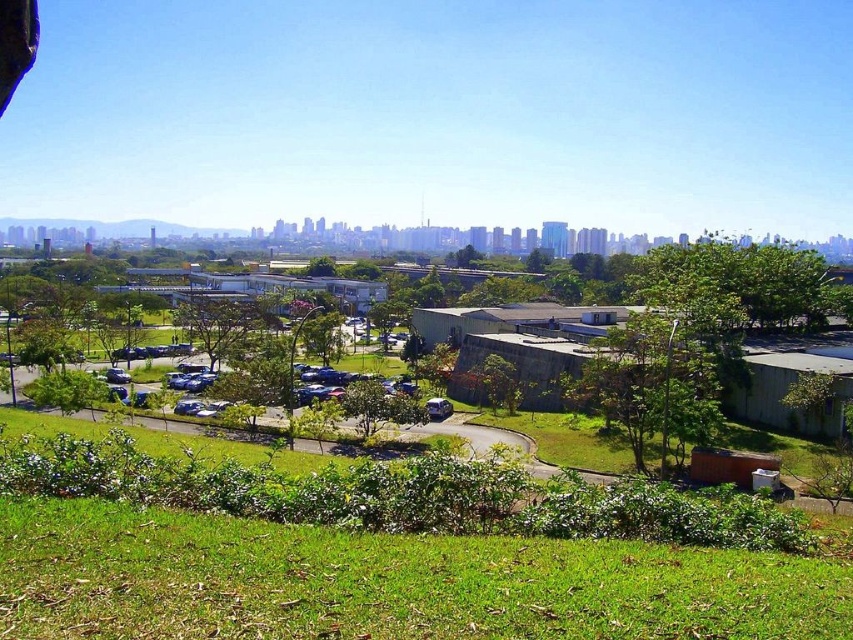
Question: Can you confirm if green grassy park at lower left is positioned to the right of green leafy tree at center?

Choices:
 (A) yes
 (B) no

Answer: (B)

Question: Can you confirm if green grassy park at lower left is positioned to the left of green leafy tree at center?

Choices:
 (A) yes
 (B) no

Answer: (A)

Question: Does green grassy park at lower left appear under green leafy tree at center?

Choices:
 (A) yes
 (B) no

Answer: (A)

Question: Which of the following is the closest to the observer?

Choices:
 (A) green leafy tree at center
 (B) green grassy park at lower left

Answer: (B)